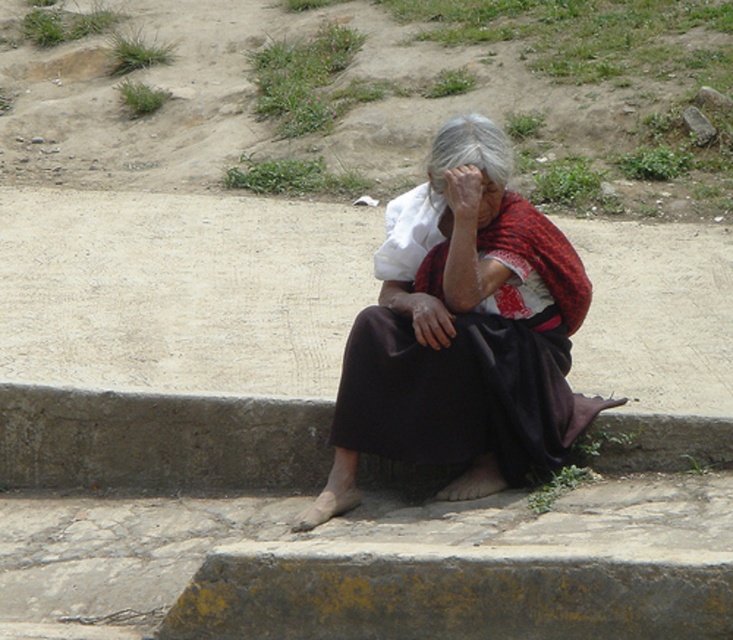
Can you confirm if dark brown fabric skirt at center is positioned to the right of gray concrete curb at lower center?

Indeed, dark brown fabric skirt at center is positioned on the right side of gray concrete curb at lower center.

Between dark brown fabric skirt at center and gray concrete curb at lower center, which one appears on the right side from the viewer's perspective?

Positioned to the right is dark brown fabric skirt at center.

Does point (515, 432) come in front of point (183, 449)?

Yes, point (515, 432) is in front of point (183, 449).

The height and width of the screenshot is (640, 733). I want to click on dark brown fabric skirt at center, so click(463, 339).

Can you confirm if dirt ground at upper center is thinner than smooth skin face at center?

No, dirt ground at upper center is not thinner than smooth skin face at center.

Which of these two, dirt ground at upper center or smooth skin face at center, stands shorter?

With less height is smooth skin face at center.

You are a GUI agent. You are given a task and a screenshot of the screen. Output one action in this format:
    pyautogui.click(x=<x>, y=<y>)
    Task: Click on the dirt ground at upper center
    The image size is (733, 640).
    Given the screenshot: What is the action you would take?
    pyautogui.click(x=375, y=96)

Between dirt ground at upper center and dark brown fabric skirt at center, which one has more height?

dirt ground at upper center is taller.

Is point (372, 173) farther from camera compared to point (500, 310)?

Yes, point (372, 173) is farther from viewer.

Who is more distant from viewer, (1, 20) or (497, 333)?

Result: The point (1, 20) is more distant.

Identify the location of dirt ground at upper center. This screenshot has width=733, height=640. (375, 96).